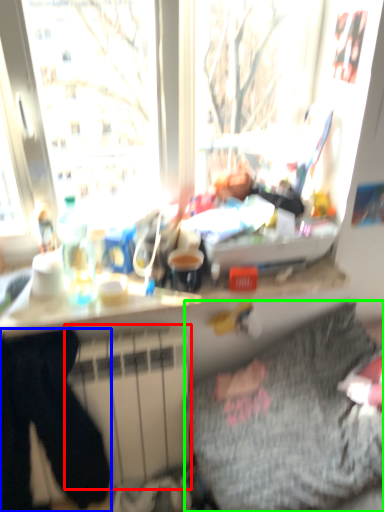
Question: Which object is positioned farthest from radiator (highlighted by a red box)? Select from sweat pant (highlighted by a blue box) and bedding (highlighted by a green box).

Choices:
 (A) sweat pant
 (B) bedding

Answer: (B)